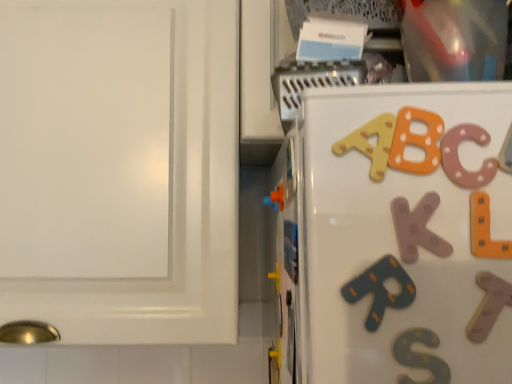
Question: Could you tell me if orange matte toy at center is turned towards white glossy cabinet at upper right?

Choices:
 (A) yes
 (B) no

Answer: (B)

Question: Is orange matte toy at center outside white glossy cabinet at upper right?

Choices:
 (A) no
 (B) yes

Answer: (B)

Question: Can you confirm if orange matte toy at center is positioned to the left of white glossy cabinet at upper right?

Choices:
 (A) yes
 (B) no

Answer: (B)

Question: Can you confirm if orange matte toy at center is shorter than white glossy cabinet at upper right?

Choices:
 (A) yes
 (B) no

Answer: (A)

Question: Are orange matte toy at center and white glossy cabinet at upper right beside each other?

Choices:
 (A) no
 (B) yes

Answer: (A)

Question: Considering the relative sizes of orange matte toy at center and white glossy cabinet at upper right in the image provided, is orange matte toy at center wider than white glossy cabinet at upper right?

Choices:
 (A) no
 (B) yes

Answer: (A)

Question: From a real-world perspective, is white glossy cabinet at upper right below orange matte toy at center?

Choices:
 (A) yes
 (B) no

Answer: (B)

Question: Is white glossy cabinet at upper right bigger than orange matte toy at center?

Choices:
 (A) no
 (B) yes

Answer: (B)

Question: Can we say white glossy cabinet at upper right lies outside orange matte toy at center?

Choices:
 (A) no
 (B) yes

Answer: (B)

Question: From a real-world perspective, is white glossy cabinet at upper right over orange matte toy at center?

Choices:
 (A) no
 (B) yes

Answer: (B)

Question: Is white glossy cabinet at upper right positioned far away from orange matte toy at center?

Choices:
 (A) yes
 (B) no

Answer: (B)

Question: Does white glossy cabinet at upper right have a lesser height compared to orange matte toy at center?

Choices:
 (A) yes
 (B) no

Answer: (B)

Question: Is orange matte magnet at center shorter than orange matte toy at center?

Choices:
 (A) yes
 (B) no

Answer: (B)